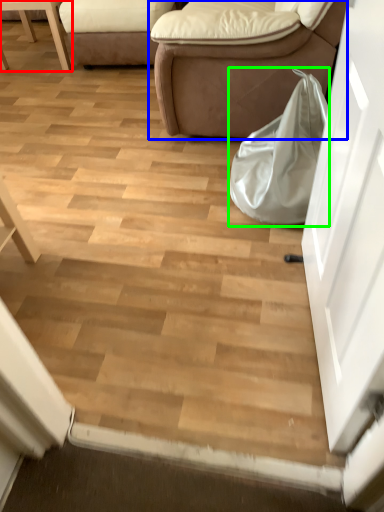
Question: Which object is positioned farthest from furniture (highlighted by a red box)? Select from studio couch (highlighted by a blue box) and bag (highlighted by a green box).

Choices:
 (A) studio couch
 (B) bag

Answer: (B)